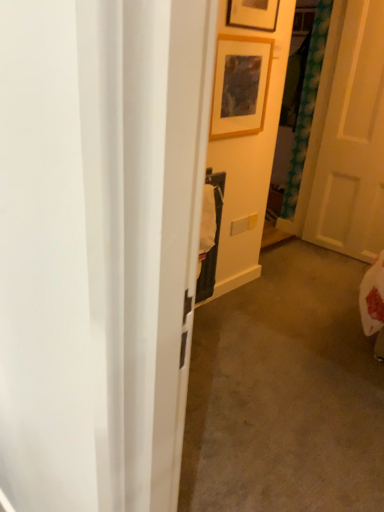
This screenshot has width=384, height=512. What do you see at coordinates (240, 85) in the screenshot?
I see `wooden frame at upper center, placed as the first picture frame when sorted from bottom to top` at bounding box center [240, 85].

The image size is (384, 512). Identify the location of wooden picture frame at upper center, the 2th picture frame positioned from the bottom. (253, 14).

Is wooden frame at upper center, the 2th picture frame from the top, not within wooden picture frame at upper center, the 2th picture frame positioned from the bottom?

Yes, wooden frame at upper center, the 2th picture frame from the top, is located beyond the bounds of wooden picture frame at upper center, the 2th picture frame positioned from the bottom.

Which is more distant, (220, 84) or (243, 17)?

Positioned behind is point (220, 84).

Locate an element on the screen. picture frame that appears below the wooden picture frame at upper center, the 1th picture frame when ordered from top to bottom (from a real-world perspective) is located at coordinates (240, 85).

Considering the sizes of objects wooden frame at upper center, the 2th picture frame from the top, and wooden picture frame at upper center, the 2th picture frame positioned from the bottom, in the image provided, who is taller, wooden frame at upper center, the 2th picture frame from the top, or wooden picture frame at upper center, the 2th picture frame positioned from the bottom,?

wooden picture frame at upper center, the 2th picture frame positioned from the bottom, is taller.

What are the coordinates of `door below the wooden picture frame at upper center, the 1th picture frame when ordered from top to bottom (from a real-world perspective)` in the screenshot? It's located at (352, 142).

From the picture: Is wooden picture frame at upper center, the 1th picture frame when ordered from top to bottom, completely or partially inside white matte door at right?

No, wooden picture frame at upper center, the 1th picture frame when ordered from top to bottom, is not inside white matte door at right.

Between white matte door at right and wooden picture frame at upper center, the 1th picture frame when ordered from top to bottom, which one is positioned in front?

wooden picture frame at upper center, the 1th picture frame when ordered from top to bottom, is closer to the camera.

Could you tell me if white matte door at right is facing wooden picture frame at upper center, the 2th picture frame positioned from the bottom?

Yes, white matte door at right is turned towards wooden picture frame at upper center, the 2th picture frame positioned from the bottom.

From the image's perspective, would you say wooden picture frame at upper center, the 2th picture frame positioned from the bottom, is positioned over white matte door at right?

Correct, wooden picture frame at upper center, the 2th picture frame positioned from the bottom, appears higher than white matte door at right in the image.

Based on the photo, is wooden picture frame at upper center, the 2th picture frame positioned from the bottom, to the left or to the right of white matte door at right in the image?

Clearly, wooden picture frame at upper center, the 2th picture frame positioned from the bottom, is on the left of white matte door at right in the image.

Which of these two, wooden picture frame at upper center, the 1th picture frame when ordered from top to bottom, or white matte door at right, stands taller?

white matte door at right.

Which object is further away from the camera, wooden picture frame at upper center, the 2th picture frame positioned from the bottom, or white matte door at right?

Positioned behind is white matte door at right.

Is wooden frame at upper center, the 2th picture frame from the top, located within wooden picture frame at upper center, the 2th picture frame positioned from the bottom?

That's incorrect, wooden frame at upper center, the 2th picture frame from the top, is not inside wooden picture frame at upper center, the 2th picture frame positioned from the bottom.

Does wooden picture frame at upper center, the 2th picture frame positioned from the bottom, turn towards wooden frame at upper center, the 2th picture frame from the top?

No, wooden picture frame at upper center, the 2th picture frame positioned from the bottom, is not oriented towards wooden frame at upper center, the 2th picture frame from the top.

Is wooden picture frame at upper center, the 2th picture frame positioned from the bottom, closer to camera compared to wooden frame at upper center, the 2th picture frame from the top?

Yes, the depth of wooden picture frame at upper center, the 2th picture frame positioned from the bottom, is less than that of wooden frame at upper center, the 2th picture frame from the top.

Is white matte door at right looking in the opposite direction of wooden frame at upper center, placed as the first picture frame when sorted from bottom to top?

That's not correct — white matte door at right is not looking away from wooden frame at upper center, placed as the first picture frame when sorted from bottom to top.

Find the location of `door below the wooden frame at upper center, placed as the first picture frame when sorted from bottom to top (from the image's perspective)`. door below the wooden frame at upper center, placed as the first picture frame when sorted from bottom to top (from the image's perspective) is located at coordinates (352, 142).

Is white matte door at right not near wooden frame at upper center, placed as the first picture frame when sorted from bottom to top?

Yes, white matte door at right and wooden frame at upper center, placed as the first picture frame when sorted from bottom to top, are located far from each other.

From the image's perspective, is white matte door at right on top of wooden frame at upper center, placed as the first picture frame when sorted from bottom to top?

No, from the image's perspective, white matte door at right is not over wooden frame at upper center, placed as the first picture frame when sorted from bottom to top.

Is wooden frame at upper center, the 2th picture frame from the top, not close to white matte door at right?

That's right, there is a large distance between wooden frame at upper center, the 2th picture frame from the top, and white matte door at right.

Considering the sizes of wooden frame at upper center, placed as the first picture frame when sorted from bottom to top, and white matte door at right in the image, is wooden frame at upper center, placed as the first picture frame when sorted from bottom to top, taller or shorter than white matte door at right?

wooden frame at upper center, placed as the first picture frame when sorted from bottom to top, is shorter than white matte door at right.

From the image's perspective, is wooden frame at upper center, the 2th picture frame from the top, on white matte door at right?

Correct, wooden frame at upper center, the 2th picture frame from the top, appears higher than white matte door at right in the image.

Is wooden frame at upper center, the 2th picture frame from the top, bigger than white matte door at right?

Incorrect, wooden frame at upper center, the 2th picture frame from the top, is not larger than white matte door at right.

Locate an element on the screen. This screenshot has width=384, height=512. picture frame on the right of wooden frame at upper center, the 2th picture frame from the top is located at coordinates (253, 14).

I want to click on door behind the wooden picture frame at upper center, the 2th picture frame positioned from the bottom, so click(x=352, y=142).

Considering their positions, is white matte door at right positioned closer to wooden frame at upper center, placed as the first picture frame when sorted from bottom to top, than wooden picture frame at upper center, the 2th picture frame positioned from the bottom?

wooden picture frame at upper center, the 2th picture frame positioned from the bottom, lies closer to wooden frame at upper center, placed as the first picture frame when sorted from bottom to top, than the other object.

Which object lies nearer to the anchor point wooden frame at upper center, the 2th picture frame from the top, wooden picture frame at upper center, the 2th picture frame positioned from the bottom, or white matte door at right?

wooden picture frame at upper center, the 2th picture frame positioned from the bottom, is positioned closer to the anchor wooden frame at upper center, the 2th picture frame from the top.

Considering their positions, is white matte door at right positioned closer to wooden picture frame at upper center, the 2th picture frame positioned from the bottom, than wooden frame at upper center, the 2th picture frame from the top?

Based on the image, wooden frame at upper center, the 2th picture frame from the top, appears to be nearer to wooden picture frame at upper center, the 2th picture frame positioned from the bottom.

Looking at the image, which one is located closer to wooden picture frame at upper center, the 2th picture frame positioned from the bottom, wooden frame at upper center, the 2th picture frame from the top, or white matte door at right?

wooden frame at upper center, the 2th picture frame from the top, is positioned closer to the anchor wooden picture frame at upper center, the 2th picture frame positioned from the bottom.

Based on their spatial positions, is wooden frame at upper center, the 2th picture frame from the top, or wooden picture frame at upper center, the 1th picture frame when ordered from top to bottom, closer to white matte door at right?

Based on the image, wooden frame at upper center, the 2th picture frame from the top, appears to be nearer to white matte door at right.

Considering their positions, is wooden picture frame at upper center, the 1th picture frame when ordered from top to bottom, positioned further to white matte door at right than wooden frame at upper center, placed as the first picture frame when sorted from bottom to top?

wooden picture frame at upper center, the 1th picture frame when ordered from top to bottom, is positioned further to the anchor white matte door at right.

The height and width of the screenshot is (512, 384). I want to click on picture frame located between wooden frame at upper center, placed as the first picture frame when sorted from bottom to top, and white matte door at right in the left-right direction, so click(253, 14).